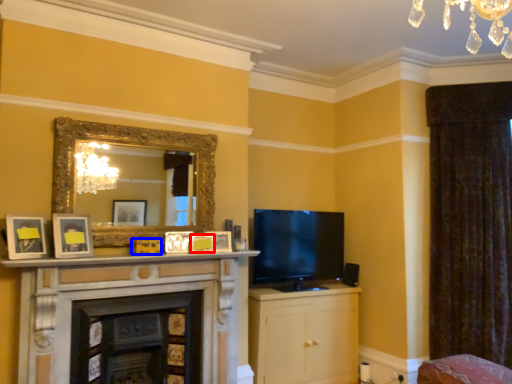
Question: Among these objects, which one is nearest to the camera, picture frame (highlighted by a red box) or picture frame (highlighted by a blue box)?

Choices:
 (A) picture frame
 (B) picture frame

Answer: (B)